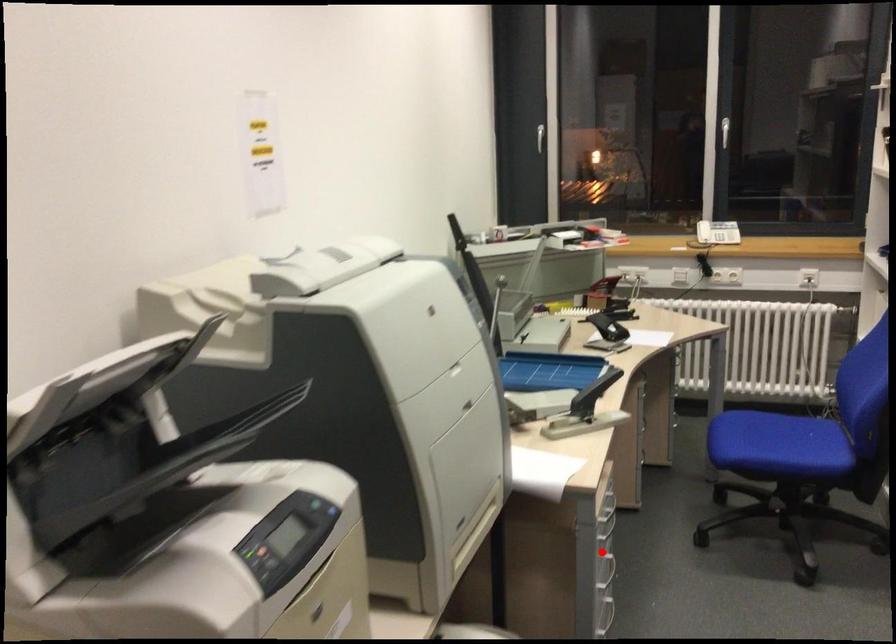
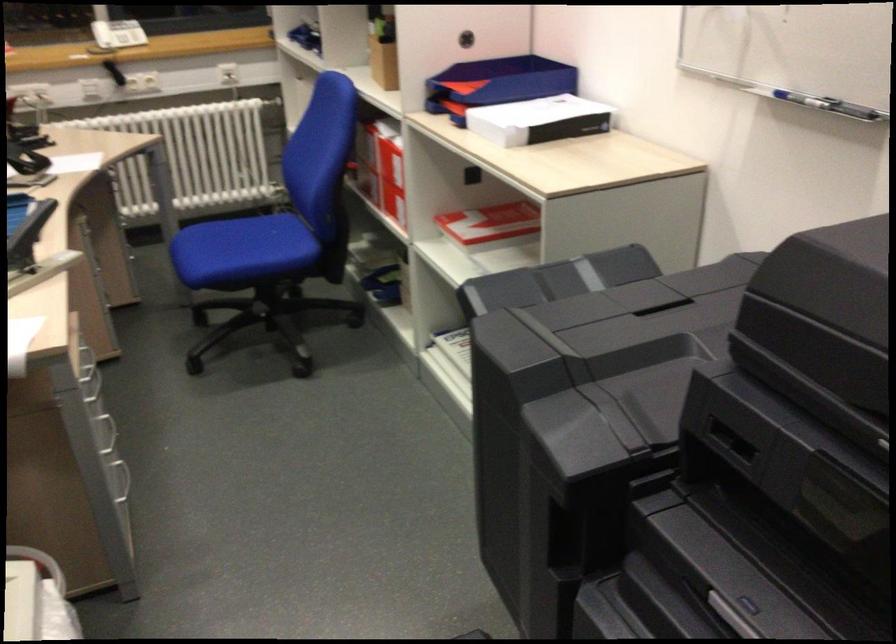
Locate, in the second image, the point that corresponds to the highlighted location in the first image.

(101, 419)